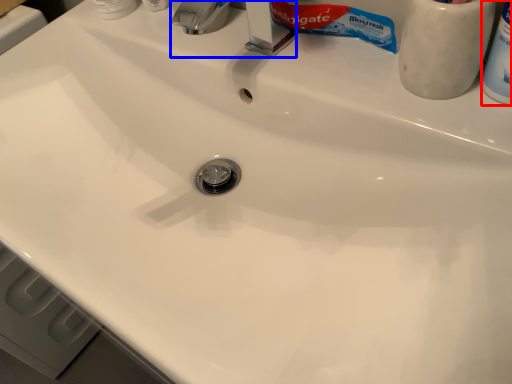
Question: Among these objects, which one is farthest to the camera, toiletry (highlighted by a red box) or faucet (highlighted by a blue box)?

Choices:
 (A) toiletry
 (B) faucet

Answer: (B)